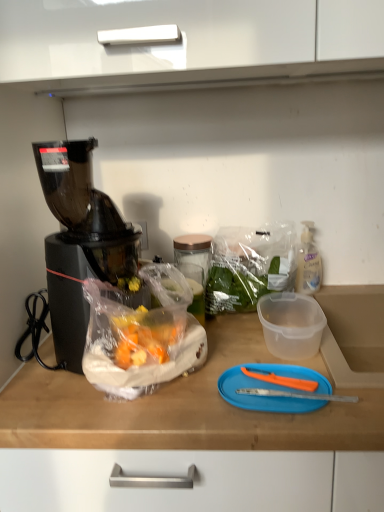
Question: Could you tell me if black plastic blender at left is facing clear plastic bottle at right?

Choices:
 (A) yes
 (B) no

Answer: (B)

Question: From the image's perspective, is black plastic blender at left on top of clear plastic bottle at right?

Choices:
 (A) no
 (B) yes

Answer: (B)

Question: From the image's perspective, would you say black plastic blender at left is shown under clear plastic bottle at right?

Choices:
 (A) no
 (B) yes

Answer: (A)

Question: Does black plastic blender at left have a lesser width compared to clear plastic bottle at right?

Choices:
 (A) yes
 (B) no

Answer: (B)

Question: Does black plastic blender at left appear on the right side of clear plastic bottle at right?

Choices:
 (A) no
 (B) yes

Answer: (A)

Question: Is point (87, 226) closer or farther from the camera than point (226, 287)?

Choices:
 (A) closer
 (B) farther

Answer: (A)

Question: From the image's perspective, is black plastic blender at left positioned above or below translucent plastic bag at center?

Choices:
 (A) below
 (B) above

Answer: (B)

Question: Is black plastic blender at left taller or shorter than translucent plastic bag at center?

Choices:
 (A) tall
 (B) short

Answer: (A)

Question: From a real-world perspective, is black plastic blender at left above or below translucent plastic bag at center?

Choices:
 (A) above
 (B) below

Answer: (A)

Question: Is black plastic blender at left in front of or behind blue plastic cutting board at center in the image?

Choices:
 (A) behind
 (B) front

Answer: (A)

Question: From their relative heights in the image, would you say black plastic blender at left is taller or shorter than blue plastic cutting board at center?

Choices:
 (A) short
 (B) tall

Answer: (B)

Question: In the image, is black plastic blender at left on the left side or the right side of blue plastic cutting board at center?

Choices:
 (A) left
 (B) right

Answer: (A)

Question: Based on their sizes in the image, would you say black plastic blender at left is bigger or smaller than blue plastic cutting board at center?

Choices:
 (A) big
 (B) small

Answer: (A)

Question: Is translucent plastic bag at center taller or shorter than black plastic blender at left?

Choices:
 (A) tall
 (B) short

Answer: (B)

Question: From the image's perspective, is translucent plastic bag at center positioned above or below black plastic blender at left?

Choices:
 (A) above
 (B) below

Answer: (B)